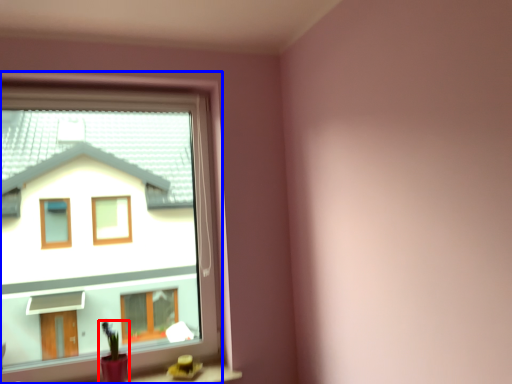
Question: Which object is further to the camera taking this photo, houseplant (highlighted by a red box) or window (highlighted by a blue box)?

Choices:
 (A) houseplant
 (B) window

Answer: (A)